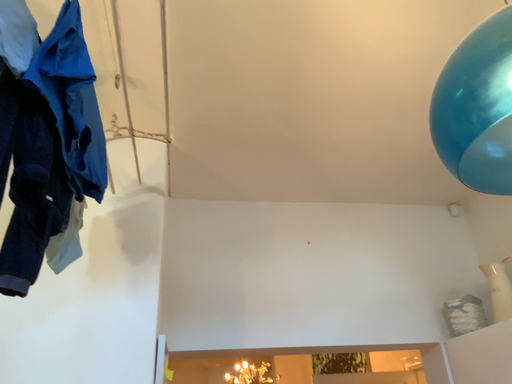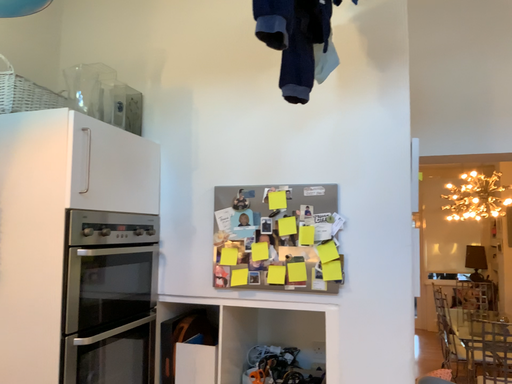
Question: Which way did the camera rotate in the video?

Choices:
 (A) rotated downward
 (B) rotated upward

Answer: (A)